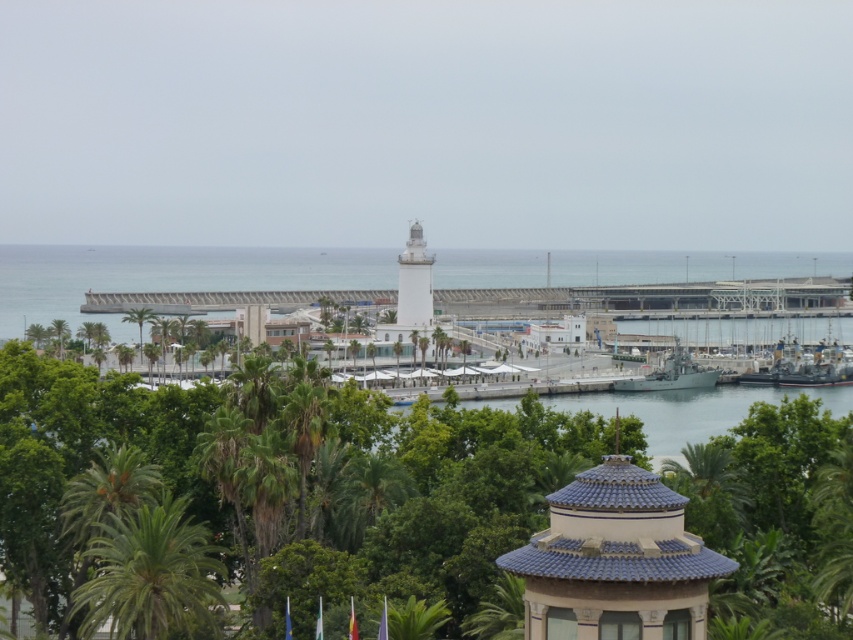
Between metallic gray ship at lower right and white smooth tower at center, which one appears on the left side from the viewer's perspective?

Positioned to the left is white smooth tower at center.

Where is `metallic gray ship at lower right`? The image size is (853, 640). metallic gray ship at lower right is located at coordinates (805, 364).

Which is in front, point (844, 380) or point (415, 273)?

Positioned in front is point (415, 273).

Locate an element on the screen. metallic gray ship at lower right is located at coordinates (805, 364).

Which is more to the left, green leafy palm tree at center or white smooth tower at center?

green leafy palm tree at center

Which is in front, point (310, 444) or point (412, 240)?

Point (310, 444) is in front.

Identify the location of green leafy palm tree at center. (305, 433).

Is green leafy tree at center positioned before metallic gray ship at lower right?

Yes, it is in front of metallic gray ship at lower right.

Is point (759, 420) closer to viewer compared to point (834, 356)?

Yes, it is in front of point (834, 356).

Find the location of `green leafy tree at center`. green leafy tree at center is located at coordinates [775, 515].